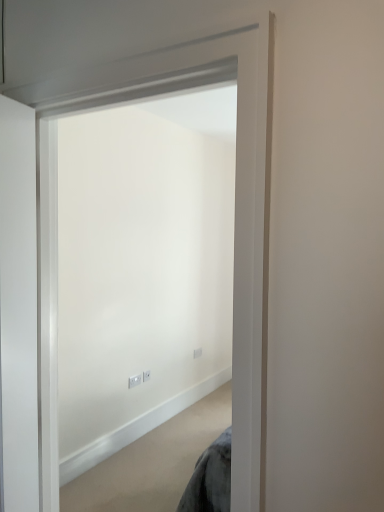
Question: Can you confirm if white plastic electric outlet at center, the first electric outlet when ordered from front to back, is positioned to the right of white plastic electric outlet at center, the first electric outlet from the back?

Choices:
 (A) no
 (B) yes

Answer: (A)

Question: From a real-world perspective, is white plastic electric outlet at center, the third electric outlet viewed from the right, located higher than white plastic electric outlet at center, the first electric outlet from the back?

Choices:
 (A) yes
 (B) no

Answer: (B)

Question: Is the depth of white plastic electric outlet at center, the third electric outlet from the back, greater than that of white plastic electric outlet at center, the 3th electric outlet in the front-to-back sequence?

Choices:
 (A) no
 (B) yes

Answer: (A)

Question: Is white plastic electric outlet at center, the third electric outlet from the left, at the back of white plastic electric outlet at center, the first electric outlet when ordered from front to back?

Choices:
 (A) no
 (B) yes

Answer: (A)

Question: Is white plastic electric outlet at center, which is counted as the 1th electric outlet, starting from the left, wider than white plastic electric outlet at center, the 3th electric outlet in the front-to-back sequence?

Choices:
 (A) yes
 (B) no

Answer: (A)

Question: Can you confirm if white plastic electric outlet at center, which is counted as the 1th electric outlet, starting from the left, is shorter than white plastic electric outlet at center, the 3th electric outlet in the front-to-back sequence?

Choices:
 (A) yes
 (B) no

Answer: (A)

Question: Does white plastic electric outlet at center, the second electric outlet when ordered from back to front, appear on the left side of white matte door at center?

Choices:
 (A) no
 (B) yes

Answer: (B)

Question: From the image's perspective, is white plastic electric outlet at center, the 2th electric outlet from the left, on white matte door at center?

Choices:
 (A) yes
 (B) no

Answer: (B)

Question: From a real-world perspective, is white plastic electric outlet at center, the 2th electric outlet from the left, located higher than white matte door at center?

Choices:
 (A) yes
 (B) no

Answer: (B)

Question: Is white plastic electric outlet at center, the second electric outlet positioned from the front, oriented away from white matte door at center?

Choices:
 (A) yes
 (B) no

Answer: (B)

Question: Is white matte door at center completely or partially inside white plastic electric outlet at center, the second electric outlet when ordered from back to front?

Choices:
 (A) yes
 (B) no

Answer: (B)

Question: Is white plastic electric outlet at center, placed as the second electric outlet when sorted from right to left, shorter than white matte door at center?

Choices:
 (A) yes
 (B) no

Answer: (A)

Question: From a real-world perspective, does white plastic electric outlet at center, the third electric outlet from the left, sit lower than white plastic electric outlet at center, the 2th electric outlet from the left?

Choices:
 (A) no
 (B) yes

Answer: (B)